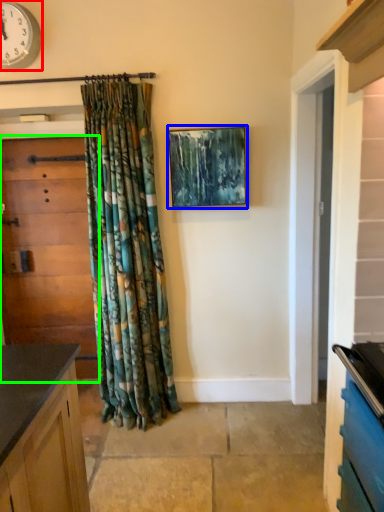
Question: Based on their relative distances, which object is farther from clock (highlighted by a red box)? Choose from picture frame (highlighted by a blue box) and door (highlighted by a green box).

Choices:
 (A) picture frame
 (B) door

Answer: (A)